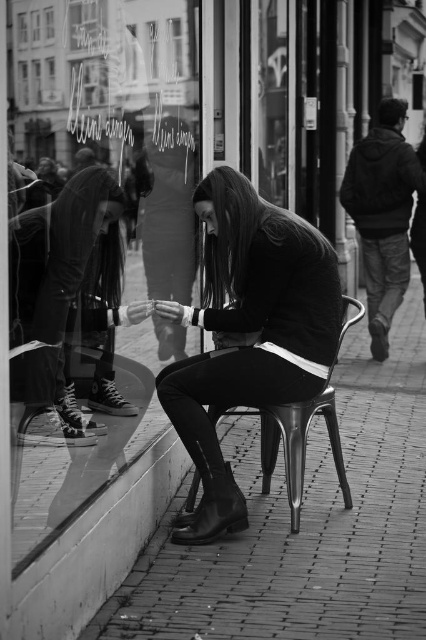
Question: Estimate the real-world distances between objects in this image. Which object is farther from the transparent glass at upper left?

Choices:
 (A) matte black sweater at center
 (B) metallic pavement at lower center

Answer: (B)

Question: Which object is positioned closest to the transparent glass at center?

Choices:
 (A) metallic pavement at lower center
 (B) transparent glass at upper left
 (C) matte black sweater at center

Answer: (C)

Question: Does transparent glass at center appear under transparent glass at upper left?

Choices:
 (A) yes
 (B) no

Answer: (A)

Question: Which point is farther to the camera?

Choices:
 (A) metallic pavement at lower center
 (B) matte black sweater at center
 (C) transparent glass at upper left
 (D) transparent glass at center

Answer: (B)

Question: Considering the relative positions of transparent glass at center and transparent glass at upper left in the image provided, where is transparent glass at center located with respect to transparent glass at upper left?

Choices:
 (A) below
 (B) above

Answer: (A)

Question: Observing the image, what is the correct spatial positioning of metallic pavement at lower center in reference to matte black sweater at center?

Choices:
 (A) right
 (B) left

Answer: (A)